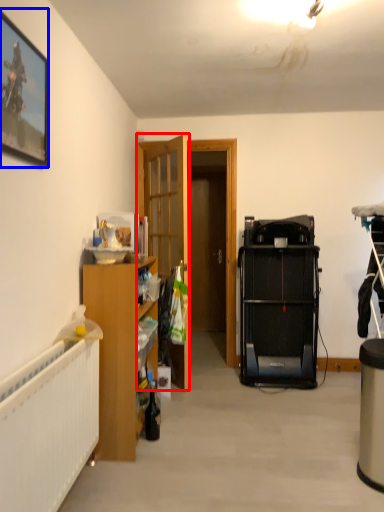
Question: Which of the following is the farthest to the observer, door (highlighted by a red box) or picture frame (highlighted by a blue box)?

Choices:
 (A) door
 (B) picture frame

Answer: (A)